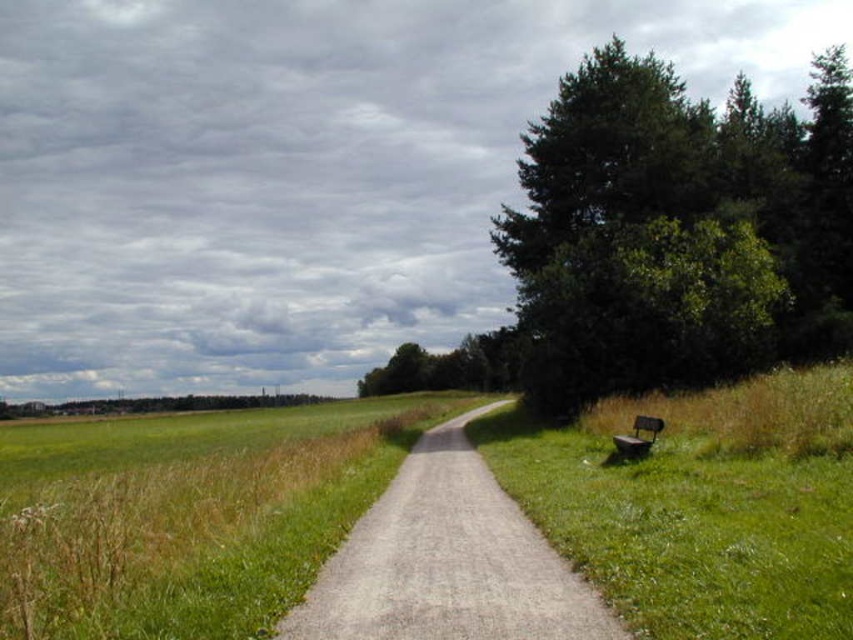
Question: Can you confirm if dark green leafy tree at upper right is wider than gray gravel path at center?

Choices:
 (A) yes
 (B) no

Answer: (A)

Question: Among these objects, which one is nearest to the camera?

Choices:
 (A) wooden park bench at right
 (B) gray gravel path at center

Answer: (B)

Question: Is dark green leafy tree at upper right below wooden park bench at right?

Choices:
 (A) no
 (B) yes

Answer: (A)

Question: Which of these objects is positioned closest to the wooden park bench at right?

Choices:
 (A) dark green leafy tree at upper right
 (B) gray gravel path at center

Answer: (B)

Question: Which of the following is the farthest from the observer?

Choices:
 (A) (646, 429)
 (B) (570, 362)

Answer: (B)

Question: Does dark green leafy tree at upper right come in front of wooden park bench at right?

Choices:
 (A) yes
 (B) no

Answer: (B)